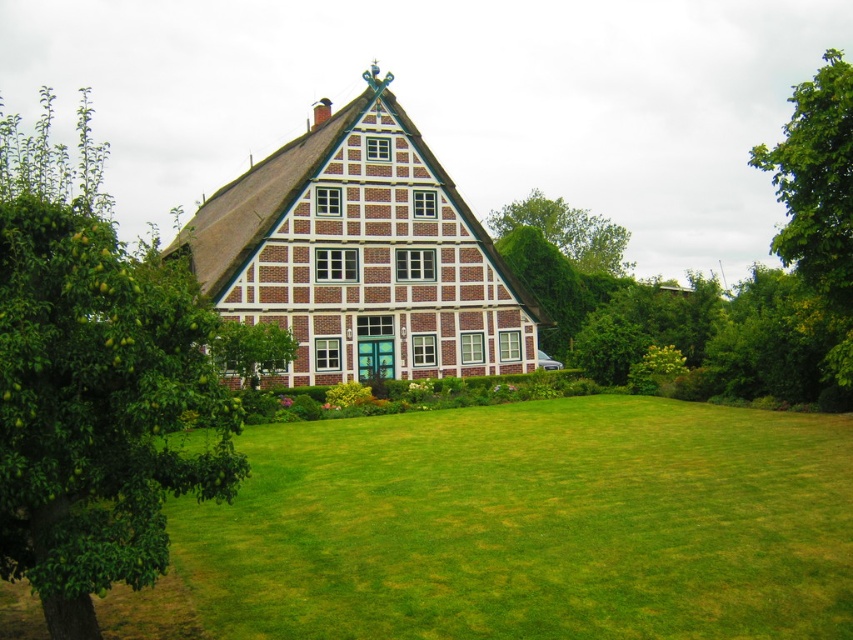
You are standing in the front yard of the brick house at center and want to walk to the green leafy tree at left. Which direction should you face to walk directly towards it?

You should face to the left direction to walk directly towards the green leafy tree at left since it is located to the left of the brick house at center.

You are standing at point A located at coordinates 0.5, 0.5. You want to walk to the brick house at center. In which direction should you move relative to your current position?

The brick house at center is located at coordinates (363, 253). Since your current position is at (426, 320), you should move to the lower left direction to reach it.